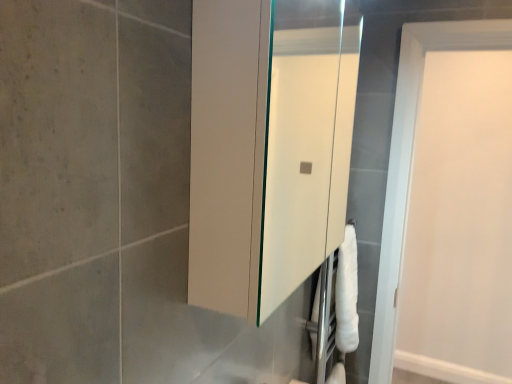
Question: Is white matte toilet paper at lower right situated inside white glossy medicine cabinet at center or outside?

Choices:
 (A) inside
 (B) outside

Answer: (B)

Question: Considering the positions of point (345, 382) and point (262, 216), is point (345, 382) closer or farther from the camera than point (262, 216)?

Choices:
 (A) closer
 (B) farther

Answer: (B)

Question: Based on their relative distances, which object is nearer to the white glossy medicine cabinet at center?

Choices:
 (A) white matte toilet paper at lower right
 (B) white matte door at upper right

Answer: (B)

Question: Which of these objects is positioned farthest from the white matte toilet paper at lower right?

Choices:
 (A) white glossy medicine cabinet at center
 (B) white matte door at upper right

Answer: (A)